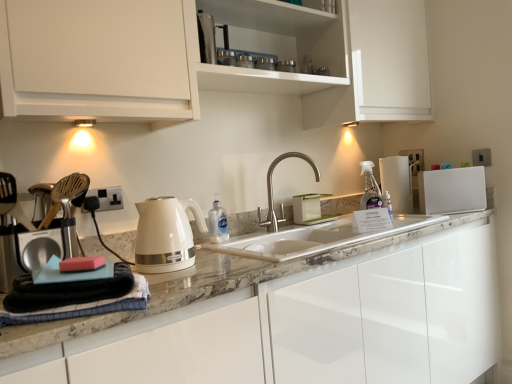
Question: Could you tell me if satin nickel faucet at center is turned towards white plastic electric outlet at upper right, the 2th electric outlet when ordered from bottom to top?

Choices:
 (A) no
 (B) yes

Answer: (A)

Question: Can you confirm if satin nickel faucet at center is taller than white plastic electric outlet at upper right, placed as the first electric outlet when sorted from top to bottom?

Choices:
 (A) no
 (B) yes

Answer: (B)

Question: Can you confirm if satin nickel faucet at center is wider than white plastic electric outlet at upper right, marked as the 2th electric outlet in a front-to-back arrangement?

Choices:
 (A) no
 (B) yes

Answer: (B)

Question: Is there a large distance between satin nickel faucet at center and white plastic electric outlet at upper right, placed as the first electric outlet when sorted from top to bottom?

Choices:
 (A) yes
 (B) no

Answer: (B)

Question: Considering the relative sizes of satin nickel faucet at center and white plastic electric outlet at upper right, which appears as the 1th electric outlet when viewed from the back, in the image provided, is satin nickel faucet at center bigger than white plastic electric outlet at upper right, which appears as the 1th electric outlet when viewed from the back,?

Choices:
 (A) yes
 (B) no

Answer: (A)

Question: Is white marble sink at center spatially inside white plastic electric outlet at upper right, positioned as the first electric outlet in right-to-left order, or outside of it?

Choices:
 (A) outside
 (B) inside

Answer: (A)

Question: Does point [307, 235] appear closer or farther from the camera than point [480, 162]?

Choices:
 (A) closer
 (B) farther

Answer: (A)

Question: Is white marble sink at center to the left or to the right of white plastic electric outlet at upper right, the 2th electric outlet when ordered from bottom to top, in the image?

Choices:
 (A) left
 (B) right

Answer: (A)

Question: From the image's perspective, is white marble sink at center above or below white plastic electric outlet at upper right, the 2th electric outlet when ordered from bottom to top?

Choices:
 (A) above
 (B) below

Answer: (B)

Question: Looking at their shapes, would you say white glossy refrigerator at right is wider or thinner than white plastic electric outlet at upper right, which appears as the 1th electric outlet when viewed from the back?

Choices:
 (A) wide
 (B) thin

Answer: (A)

Question: Would you say white glossy refrigerator at right is inside or outside white plastic electric outlet at upper right, marked as the 2th electric outlet in a front-to-back arrangement?

Choices:
 (A) inside
 (B) outside

Answer: (B)

Question: From a real-world perspective, is white glossy refrigerator at right positioned above or below white plastic electric outlet at upper right, which appears as the 1th electric outlet when viewed from the back?

Choices:
 (A) below
 (B) above

Answer: (A)

Question: From the image's perspective, is white glossy refrigerator at right positioned above or below white plastic electric outlet at upper right, placed as the first electric outlet when sorted from top to bottom?

Choices:
 (A) above
 (B) below

Answer: (B)

Question: Considering the positions of point (445, 314) and point (18, 52), is point (445, 314) closer or farther from the camera than point (18, 52)?

Choices:
 (A) closer
 (B) farther

Answer: (B)

Question: Considering the relative positions of glossy white cabinet at center, the 2th cabinetry in the top-to-bottom sequence, and white glossy cabinet at upper center, the 2th cabinetry positioned from the bottom, in the image provided, is glossy white cabinet at center, the 2th cabinetry in the top-to-bottom sequence, to the left or to the right of white glossy cabinet at upper center, the 2th cabinetry positioned from the bottom,?

Choices:
 (A) right
 (B) left

Answer: (A)